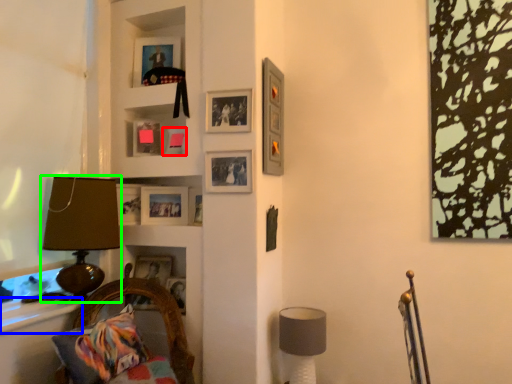
Question: Which is nearer to the picture frame (highlighted by a red box)? window sill (highlighted by a blue box) or table lamp (highlighted by a green box).

Choices:
 (A) window sill
 (B) table lamp

Answer: (B)